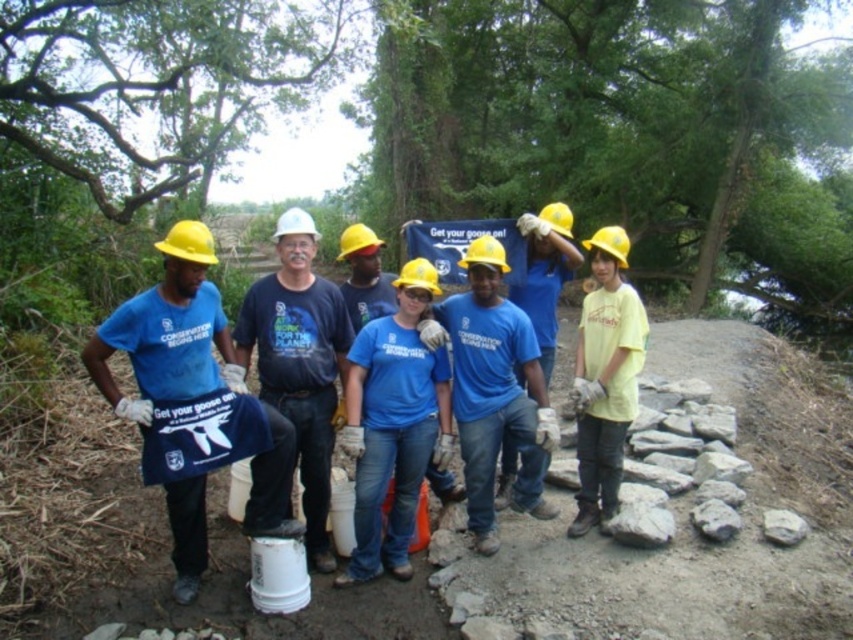
Question: Is blue cotton shirt at center bigger than white hard hat at center?

Choices:
 (A) no
 (B) yes

Answer: (B)

Question: Considering the relative positions of blue cotton shirt at center and white hard hat at center in the image provided, where is blue cotton shirt at center located with respect to white hard hat at center?

Choices:
 (A) left
 (B) right

Answer: (B)

Question: Which of the following is the farthest from the observer?

Choices:
 (A) white hard hat at center
 (B) matte blue shirt at center

Answer: (A)

Question: Does matte blue shirt at center have a greater width compared to white hard hat at center?

Choices:
 (A) yes
 (B) no

Answer: (A)

Question: Which point is closer to the camera?

Choices:
 (A) click(x=167, y=308)
 (B) click(x=297, y=227)

Answer: (A)

Question: Among these objects, which one is farthest from the camera?

Choices:
 (A) white hard hat at center
 (B) blue cotton shirt at center
 (C) matte blue shirt at center

Answer: (B)